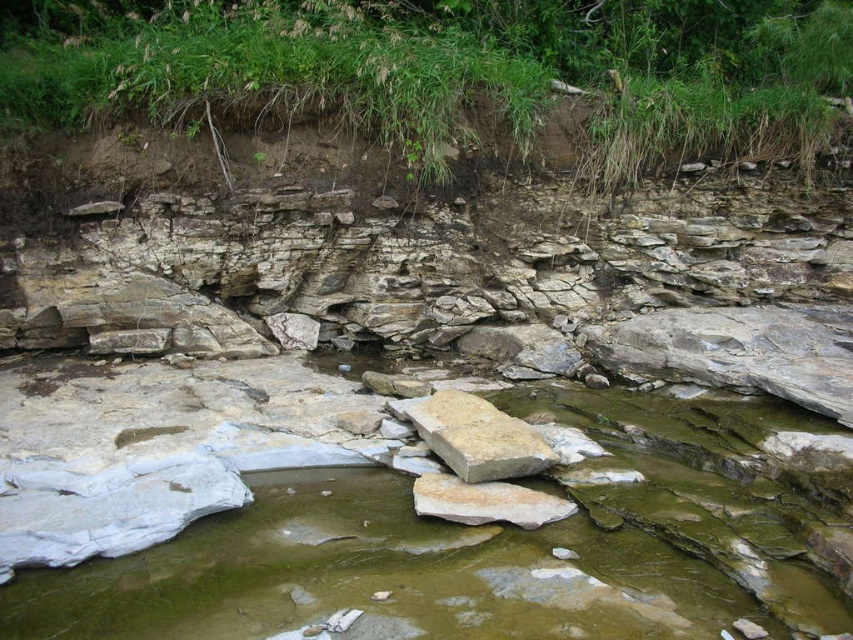
Question: Can you confirm if light brown rock at center is positioned above smooth beige rock at center?

Choices:
 (A) yes
 (B) no

Answer: (A)

Question: Which of the following is the closest to the observer?

Choices:
 (A) (466, 429)
 (B) (558, 506)

Answer: (B)

Question: Can you confirm if light brown rock at center is positioned below smooth beige rock at center?

Choices:
 (A) yes
 (B) no

Answer: (B)

Question: Which of the following is the closest to the observer?

Choices:
 (A) light brown rock at center
 (B) smooth beige rock at center

Answer: (B)

Question: Is light brown rock at center positioned in front of smooth beige rock at center?

Choices:
 (A) yes
 (B) no

Answer: (B)